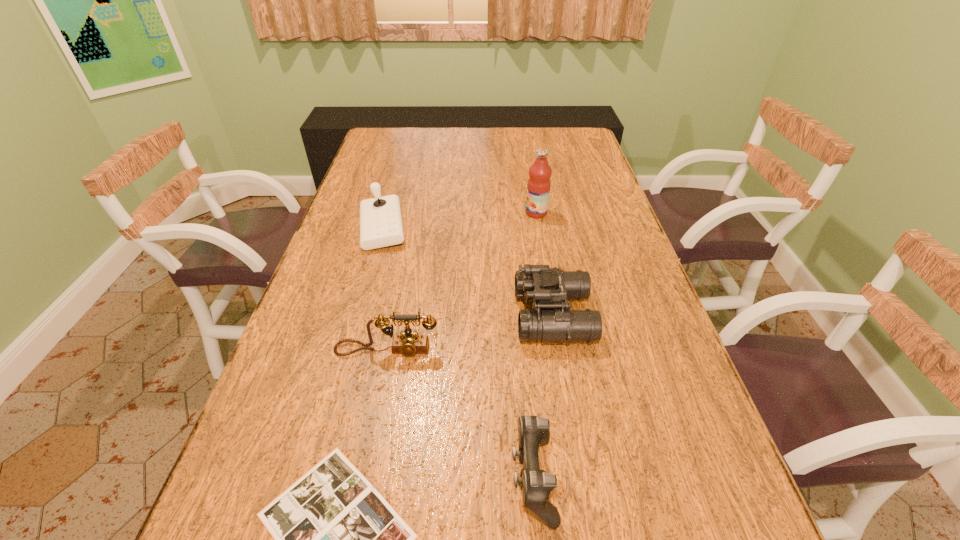
Where is `the tallest object`? This screenshot has height=540, width=960. the tallest object is located at coordinates (538, 187).

You are a GUI agent. You are given a task and a screenshot of the screen. Output one action in this format:
    pyautogui.click(x=<x>, y=<y>)
    Task: Click on the binoculars
    
    Given the screenshot: What is the action you would take?
    pyautogui.click(x=549, y=288)

Locate an element on the screen. This screenshot has width=960, height=540. joystick is located at coordinates (381, 225).

Where is `telephone`? The height and width of the screenshot is (540, 960). telephone is located at coordinates (408, 343).

Identify the location of control. (533, 431).

The image size is (960, 540). I want to click on free spot located on the front label of the fruit juice, so click(429, 213).

Find the location of a particular element. free space located 0.110m on the front label of the fruit juice is located at coordinates (490, 213).

Locate an element on the screen. This screenshot has height=540, width=960. free region located 0.360m on the front label of the fruit juice is located at coordinates (410, 213).

Where is `free space located 0.400m through the lenses of the binoculars`? free space located 0.400m through the lenses of the binoculars is located at coordinates (349, 316).

You are a GUI agent. You are given a task and a screenshot of the screen. Output one action in this format:
    pyautogui.click(x=<x>, y=<y>)
    Task: Click on the vacant space located through the lenses of the binoculars
    Image resolution: width=960 pixels, height=540 pixels.
    Given the screenshot: What is the action you would take?
    pyautogui.click(x=437, y=316)